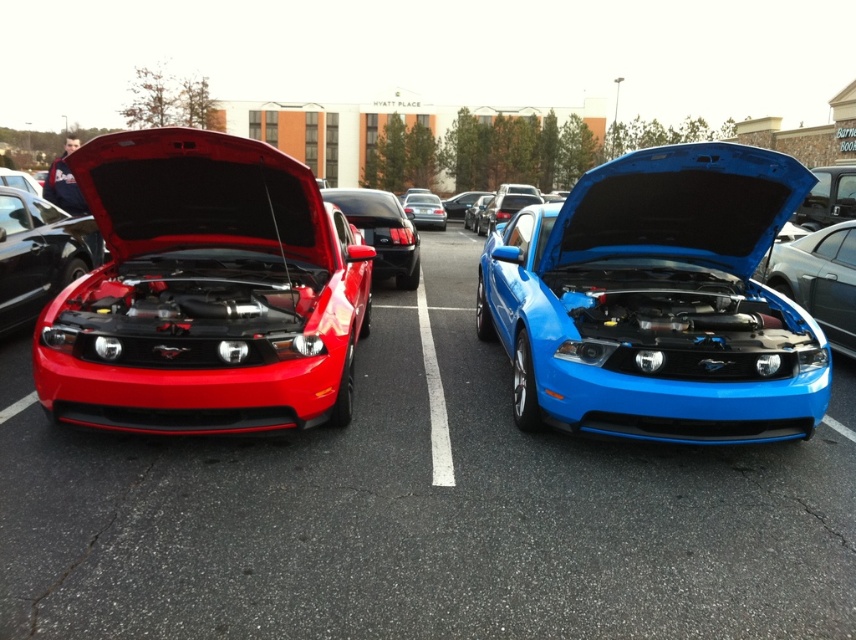
You are a photographer trying to capture both the matte black car at left and the shiny red car at left in a single shot. Since you want to ensure both are visible, which car should you position closer to the camera to avoid one blocking the other?

The matte black car at left is below the shiny red car at left, so positioning the shiny red car at left closer to the camera would help prevent it from being blocked by the matte black car at left.